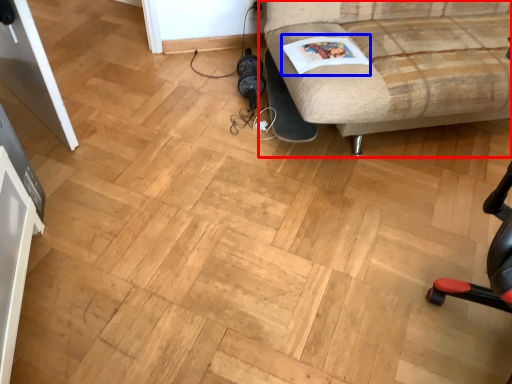
Question: Which object appears closest to the camera in this image, studio couch (highlighted by a red box) or magazine (highlighted by a blue box)?

Choices:
 (A) studio couch
 (B) magazine

Answer: (A)